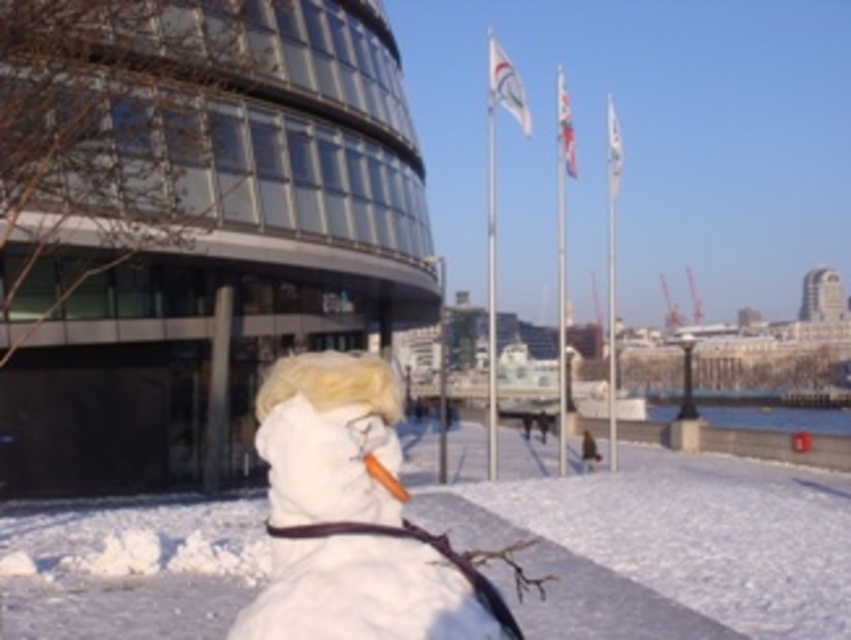
Question: Which of these objects is positioned farthest from the blonde synthetic wig at center?

Choices:
 (A) white fluffy snowman at center
 (B) white fluffy snowman at lower center

Answer: (B)

Question: Does white fluffy snowman at lower center have a smaller size compared to blonde synthetic wig at center?

Choices:
 (A) no
 (B) yes

Answer: (A)

Question: Does white fluffy snowman at lower center have a lesser width compared to white fluffy snowman at center?

Choices:
 (A) no
 (B) yes

Answer: (A)

Question: Which object is positioned farthest from the blonde synthetic wig at center?

Choices:
 (A) white fluffy snowman at lower center
 (B) white fluffy snowman at center

Answer: (A)

Question: Which object is closer to the camera taking this photo?

Choices:
 (A) white fluffy snowman at lower center
 (B) blonde synthetic wig at center
 (C) white fluffy snowman at center

Answer: (C)

Question: Can you confirm if white fluffy snowman at lower center is bigger than white fluffy snowman at center?

Choices:
 (A) yes
 (B) no

Answer: (A)